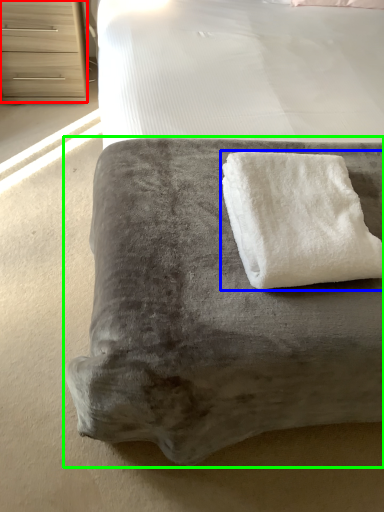
Question: Which object is positioned farthest from chest of drawers (highlighted by a red box)? Select from towel (highlighted by a blue box) and furniture (highlighted by a green box).

Choices:
 (A) towel
 (B) furniture

Answer: (A)